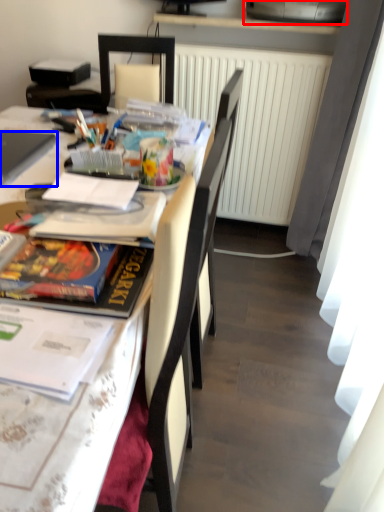
Question: Which point is closer to the camera, printer (highlighted by a red box) or laptop (highlighted by a blue box)?

Choices:
 (A) printer
 (B) laptop

Answer: (B)